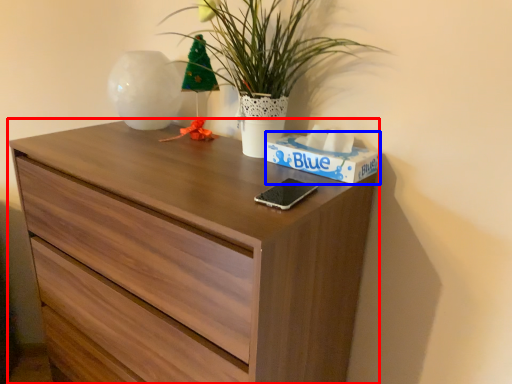
Question: Which of the following is the farthest to the observer, chest of drawers (highlighted by a red box) or box (highlighted by a blue box)?

Choices:
 (A) chest of drawers
 (B) box

Answer: (B)